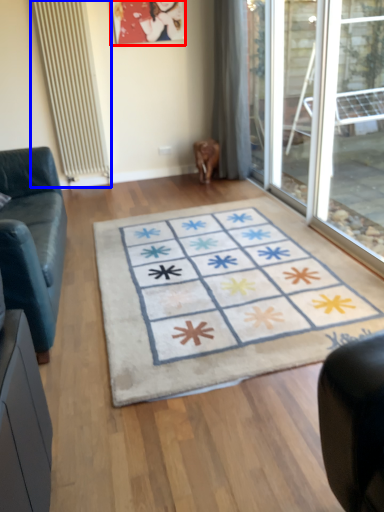
Question: Which of the following is the closest to the observer, picture frame (highlighted by a red box) or radiator (highlighted by a blue box)?

Choices:
 (A) picture frame
 (B) radiator

Answer: (B)